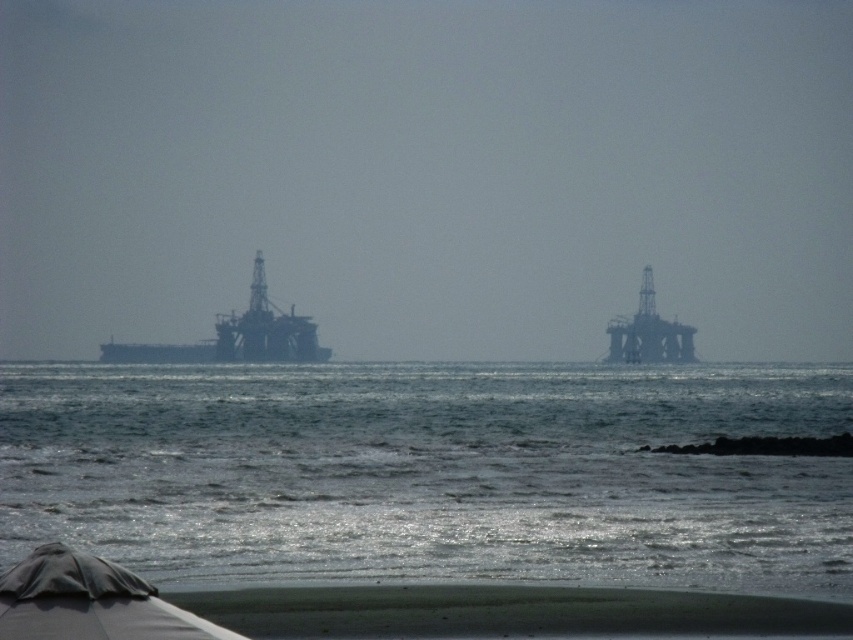
Image resolution: width=853 pixels, height=640 pixels. I want to click on clear water at lower center, so click(x=428, y=472).

Does point (10, 556) lie behind point (120, 358)?

No.

At what (x,y) coordinates should I click in order to perform the action: click on clear water at lower center. Please return your answer as a coordinate pair (x, y). The image size is (853, 640). Looking at the image, I should click on (428, 472).

Can you confirm if gray fabric umbrella at lower left is positioned above dark gray metallic oil rig at left?

No, gray fabric umbrella at lower left is not above dark gray metallic oil rig at left.

The height and width of the screenshot is (640, 853). In order to click on gray fabric umbrella at lower left in this screenshot , I will do `click(90, 602)`.

Does point (90, 592) come in front of point (267, 321)?

Yes, point (90, 592) is closer to viewer.

Locate an element on the screen. gray fabric umbrella at lower left is located at coordinates (90, 602).

Who is positioned more to the left, clear water at lower center or gray fabric umbrella at lower left?

Positioned to the left is clear water at lower center.

The image size is (853, 640). Describe the element at coordinates (428, 472) in the screenshot. I see `clear water at lower center` at that location.

The height and width of the screenshot is (640, 853). I want to click on clear water at lower center, so click(428, 472).